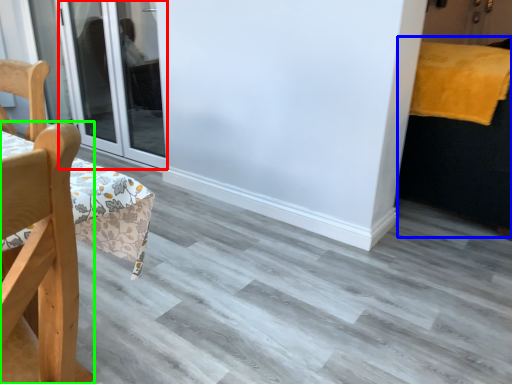
Question: Which object is positioned closest to door (highlighted by a red box)? Select from bed (highlighted by a blue box) and chair (highlighted by a green box).

Choices:
 (A) bed
 (B) chair

Answer: (A)